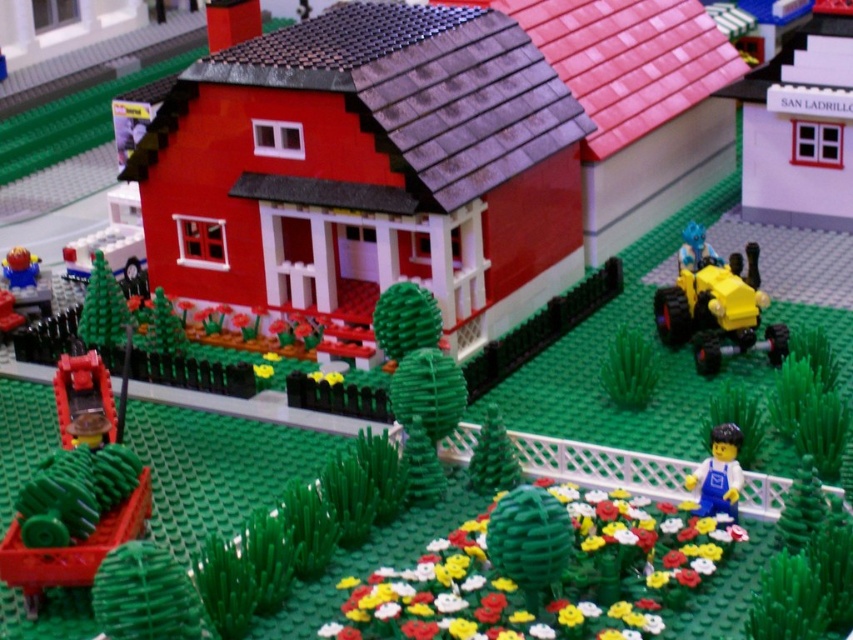
Question: Can you confirm if yellow rubber tractor at right is positioned to the left of smooth plastic minifigure at lower left?

Choices:
 (A) yes
 (B) no

Answer: (B)

Question: Which object is positioned farthest from the smooth plastic minifigure at lower left?

Choices:
 (A) blue overalls figure at lower right
 (B) yellow rubber tractor at right

Answer: (A)

Question: Can you confirm if yellow rubber tractor at right is positioned above blue overalls figure at lower right?

Choices:
 (A) yes
 (B) no

Answer: (A)

Question: Based on their relative distances, which object is nearer to the yellow rubber tractor at right?

Choices:
 (A) smooth plastic minifigure at lower left
 (B) blue overalls figure at lower right

Answer: (B)

Question: Can you confirm if blue overalls figure at lower right is positioned below smooth plastic minifigure at lower left?

Choices:
 (A) yes
 (B) no

Answer: (A)

Question: Among these points, which one is nearest to the camera?

Choices:
 (A) (730, 506)
 (B) (758, 314)

Answer: (A)